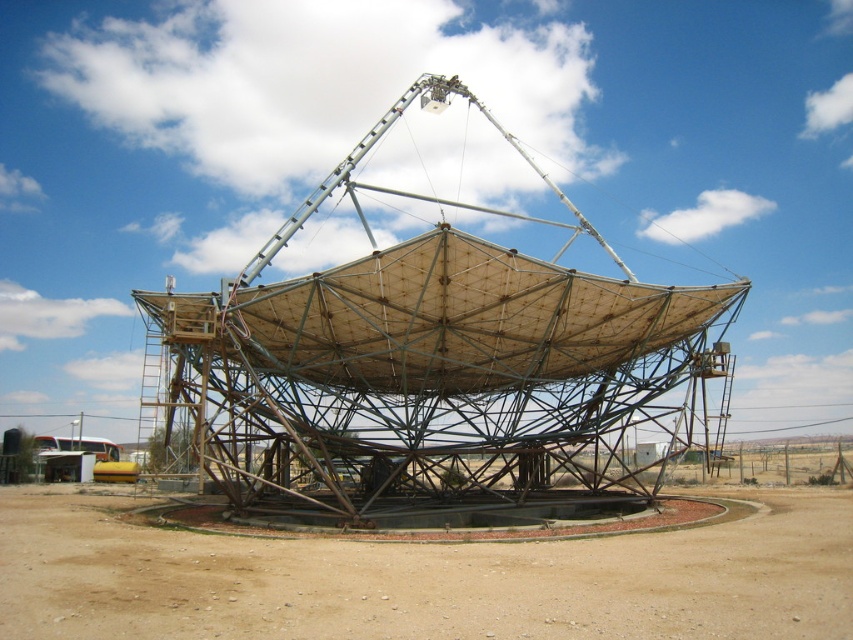
Does point (374, 410) lie behind point (22, 497)?

No, (374, 410) is closer to viewer.

Describe the element at coordinates (434, 371) in the screenshot. This screenshot has width=853, height=640. I see `metallic satellite dish at center` at that location.

At what (x,y) coordinates should I click in order to perform the action: click on metallic satellite dish at center. Please return your answer as a coordinate pair (x, y). Looking at the image, I should click on (434, 371).